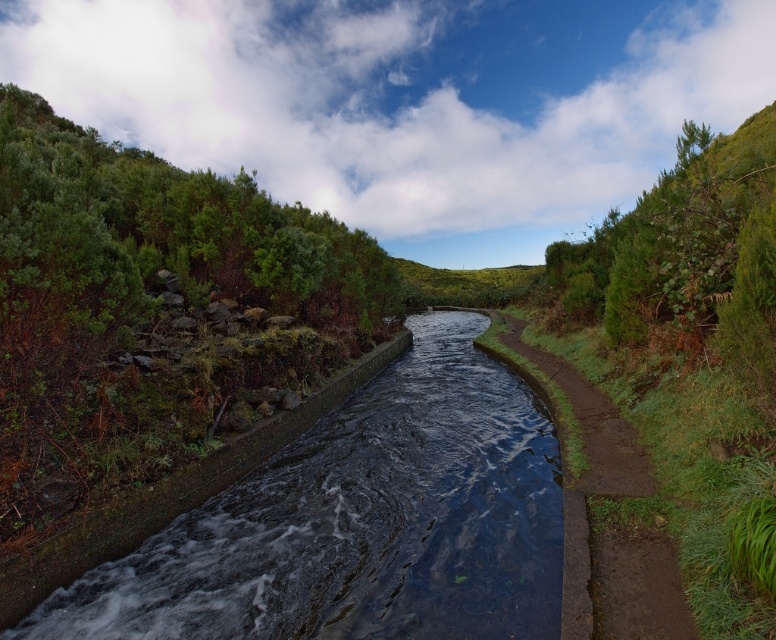
You are a gardener planning to trim the green leafy shrubs at upper left and the green leafy shrub at right. Based on their sizes, which shrub requires more branches to be cut to achieve the same desired thickness?

The green leafy shrubs at upper left is thinner than the green leafy shrub at right, so to achieve the same desired thickness, the thinner shrub at upper left would require fewer branches to be cut compared to the thicker shrub at right.

You are standing at the point with coordinates point (210, 628) and want to walk to the point (712, 168). Which direction should you move relative to the waterway?

You should move towards the waterway because point (210, 628) is in front of point (712, 168), meaning the latter is behind the former relative to the waterway.